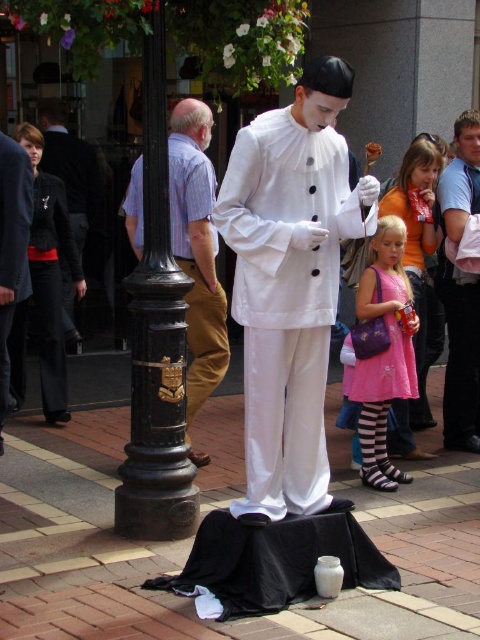
Does point (278, 225) come closer to viewer compared to point (194, 230)?

That is True.

Which is behind, point (277, 483) or point (210, 346)?

The point (210, 346) is behind.

You are a GUI agent. You are given a task and a screenshot of the screen. Output one action in this format:
    pyautogui.click(x=<x>, y=<y>)
    Task: Click on the white matte/soft clown at center
    
    Given the screenshot: What is the action you would take?
    pyautogui.click(x=289, y=282)

Does black matte cloth at lower center lie in front of light brown corduroy pants at center?

Yes, black matte cloth at lower center is in front of light brown corduroy pants at center.

Is point (227, 586) less distant than point (194, 360)?

Yes, point (227, 586) is in front of point (194, 360).

Who is more forward, (195, 573) or (204, 131)?

Positioned in front is point (195, 573).

Identify the location of black matte cloth at lower center. This screenshot has height=640, width=480. click(x=273, y=563).

Between matte blue shirt at upper right and pink satin dress at center, which one appears on the right side from the viewer's perspective?

matte blue shirt at upper right is more to the right.

Is matte blue shirt at upper right positioned before pink satin dress at center?

No.

Which is in front, point (447, 310) or point (360, 362)?

Point (360, 362) is in front.

This screenshot has height=640, width=480. I want to click on matte blue shirt at upper right, so click(x=459, y=289).